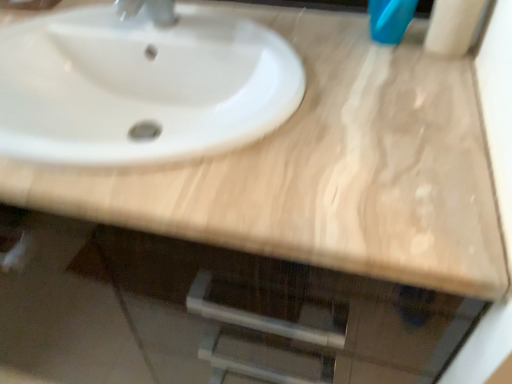
Locate an element on the screen. white glossy sink at upper center is located at coordinates (140, 86).

What do you see at coordinates (140, 86) in the screenshot? I see `white glossy sink at upper center` at bounding box center [140, 86].

From the picture: What is the approximate height of white glossy sink at upper center?

white glossy sink at upper center is 11.71 inches tall.

The width and height of the screenshot is (512, 384). What are the coordinates of `white glossy sink at upper center` in the screenshot? It's located at (140, 86).